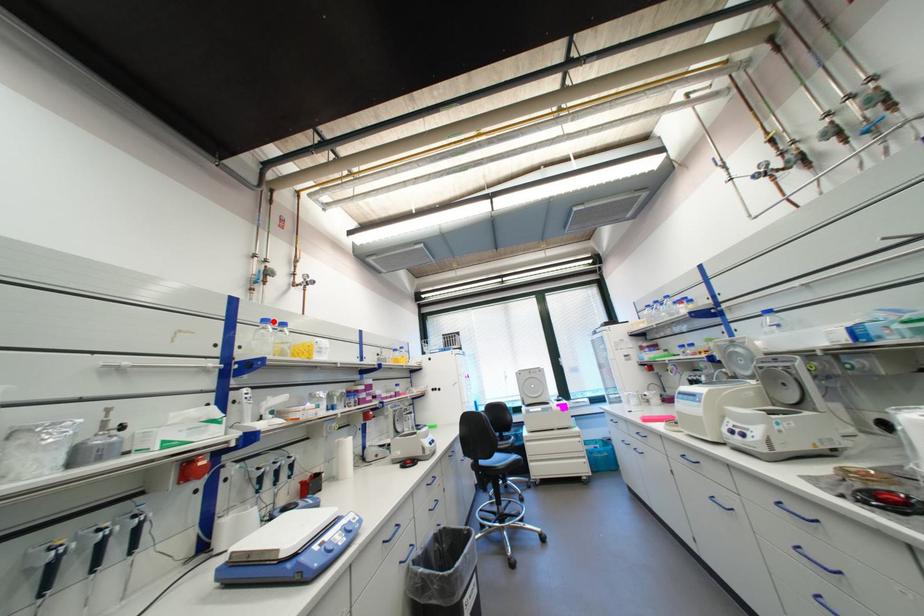
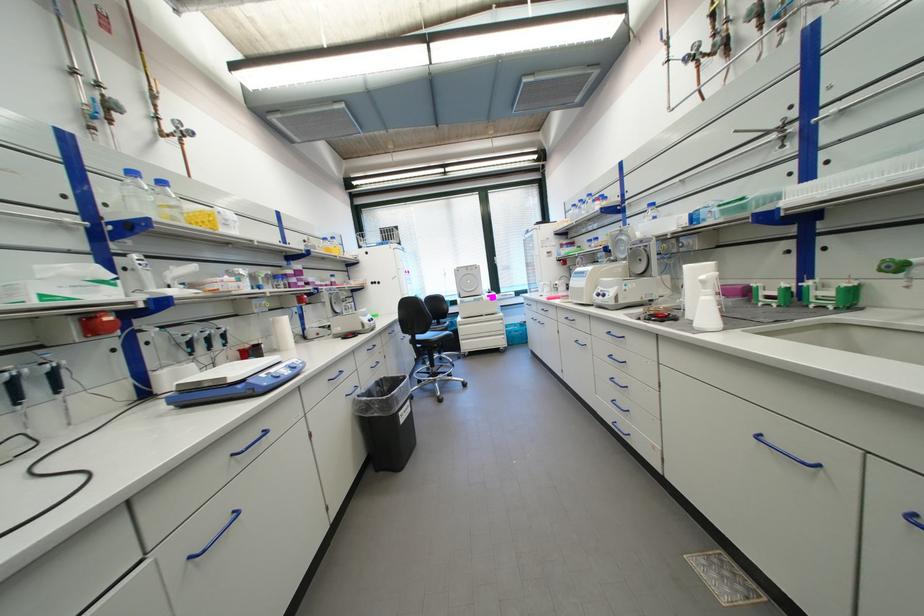
Locate, in the second image, the point that corresponds to the highlighted location in the first image.

(140, 174)